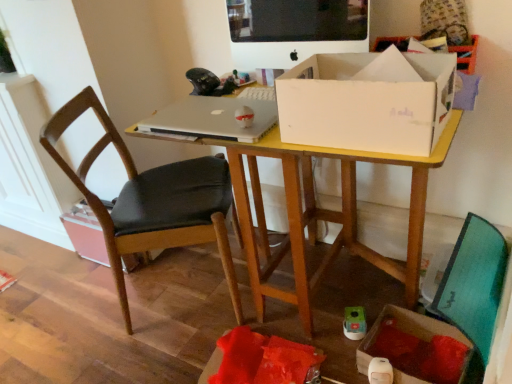
Question: Is cardboard box at lower right, the 2th cardboard box positioned from the back, shorter than matte black monitor at upper center?

Choices:
 (A) yes
 (B) no

Answer: (A)

Question: Does cardboard box at lower right, marked as the 2th cardboard box in a top-to-bottom arrangement, appear on the right side of matte black monitor at upper center?

Choices:
 (A) yes
 (B) no

Answer: (A)

Question: Considering the relative sizes of cardboard box at lower right, marked as the 2th cardboard box in a top-to-bottom arrangement, and matte black monitor at upper center in the image provided, is cardboard box at lower right, marked as the 2th cardboard box in a top-to-bottom arrangement, taller than matte black monitor at upper center?

Choices:
 (A) no
 (B) yes

Answer: (A)

Question: Considering the relative sizes of cardboard box at lower right, the 1th cardboard box positioned from the right, and matte black monitor at upper center in the image provided, is cardboard box at lower right, the 1th cardboard box positioned from the right, smaller than matte black monitor at upper center?

Choices:
 (A) no
 (B) yes

Answer: (B)

Question: Is cardboard box at lower right, the 2th cardboard box positioned from the back, wider than matte black monitor at upper center?

Choices:
 (A) yes
 (B) no

Answer: (A)

Question: Do you think white cardboard box at center is within silver metallic laptop at center, or outside of it?

Choices:
 (A) outside
 (B) inside

Answer: (A)

Question: Does point (380, 110) appear closer or farther from the camera than point (242, 100)?

Choices:
 (A) farther
 (B) closer

Answer: (B)

Question: Considering the positions of white cardboard box at center and silver metallic laptop at center in the image, is white cardboard box at center taller or shorter than silver metallic laptop at center?

Choices:
 (A) short
 (B) tall

Answer: (B)

Question: Is white cardboard box at center in front of or behind silver metallic laptop at center in the image?

Choices:
 (A) behind
 (B) front

Answer: (B)

Question: In terms of height, does cardboard box at lower right, the 2th cardboard box when ordered from left to right, look taller or shorter compared to yellow wood desk at center?

Choices:
 (A) tall
 (B) short

Answer: (B)

Question: Is point (455, 372) positioned closer to the camera than point (346, 220)?

Choices:
 (A) closer
 (B) farther

Answer: (A)

Question: From the image's perspective, is cardboard box at lower right, the 2th cardboard box when ordered from left to right, positioned above or below yellow wood desk at center?

Choices:
 (A) above
 (B) below

Answer: (B)

Question: In terms of size, does cardboard box at lower right, the 2th cardboard box when ordered from left to right, appear bigger or smaller than yellow wood desk at center?

Choices:
 (A) big
 (B) small

Answer: (B)

Question: In terms of height, does yellow wood desk at center look taller or shorter compared to matte black monitor at upper center?

Choices:
 (A) tall
 (B) short

Answer: (A)

Question: Does point (296, 261) appear closer or farther from the camera than point (298, 31)?

Choices:
 (A) farther
 (B) closer

Answer: (B)